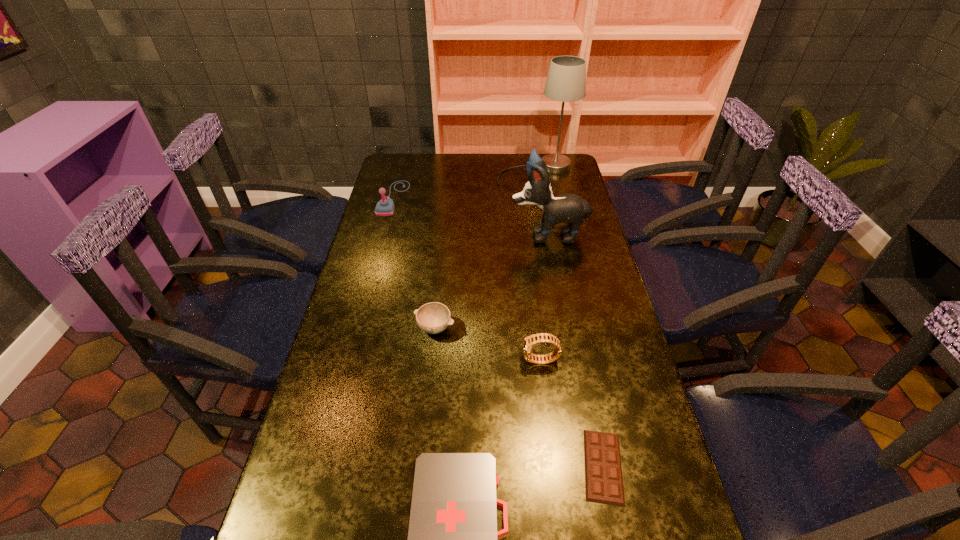
Where is `vacant space at the far right corner`? The image size is (960, 540). vacant space at the far right corner is located at coordinates (556, 179).

This screenshot has width=960, height=540. In order to click on unoccupied area between the joystick and the tallest object in this screenshot , I will do `click(465, 185)`.

I want to click on empty space that is in between the chocolate bar and the watch, so click(572, 414).

Locate an element on the screen. The image size is (960, 540). vacant space that's between the second tallest object and the chocolate bar is located at coordinates (576, 350).

Identify which object is the fourth nearest to the leftmost object. Please provide its 2D coordinates. Your answer should be formatted as a tuple, i.e. [(x, y)], where the tuple contains the x and y coordinates of a point satisfying the conditions above.

[(529, 341)]

Choose which object is the fourth nearest neighbor to the joystick. Please provide its 2D coordinates. Your answer should be formatted as a tuple, i.e. [(x, y)], where the tuple contains the x and y coordinates of a point satisfying the conditions above.

[(529, 341)]

You are a GUI agent. You are given a task and a screenshot of the screen. Output one action in this format:
    pyautogui.click(x=<x>, y=<y>)
    Task: Click on the vacant position in the image that satisfies the following two spatial constraints: 1. on the face of the chocolate bar; 2. on the left side of the watch
    The image size is (960, 540).
    Given the screenshot: What is the action you would take?
    pyautogui.click(x=554, y=466)

Find the location of a particular element. This screenshot has height=540, width=960. vacant space that satisfies the following two spatial constraints: 1. on the face of the watch; 2. on the back side of the chocolate bar is located at coordinates (554, 466).

Locate an element on the screen. This screenshot has width=960, height=540. vacant region that satisfies the following two spatial constraints: 1. on the face of the chocolate bar; 2. on the left side of the third nearest object is located at coordinates (554, 466).